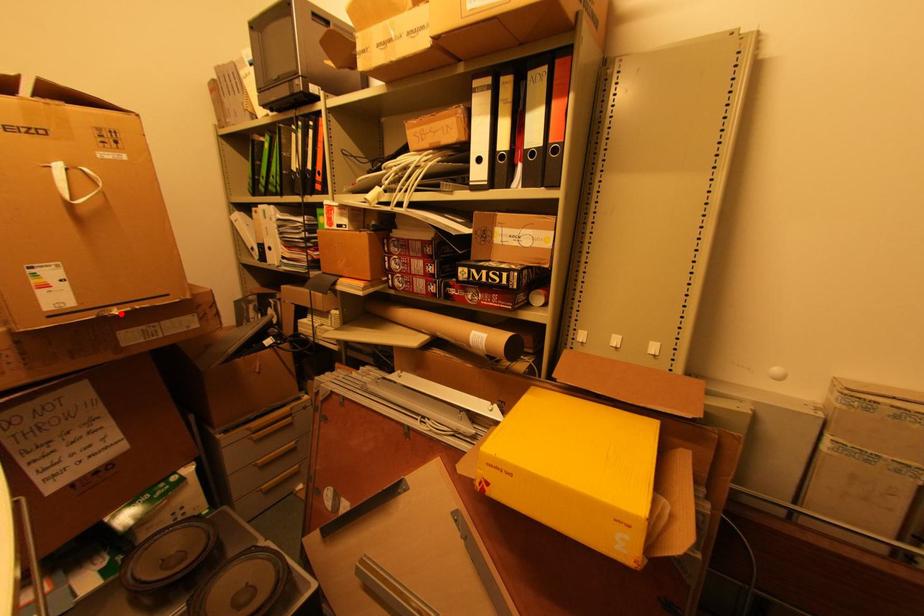
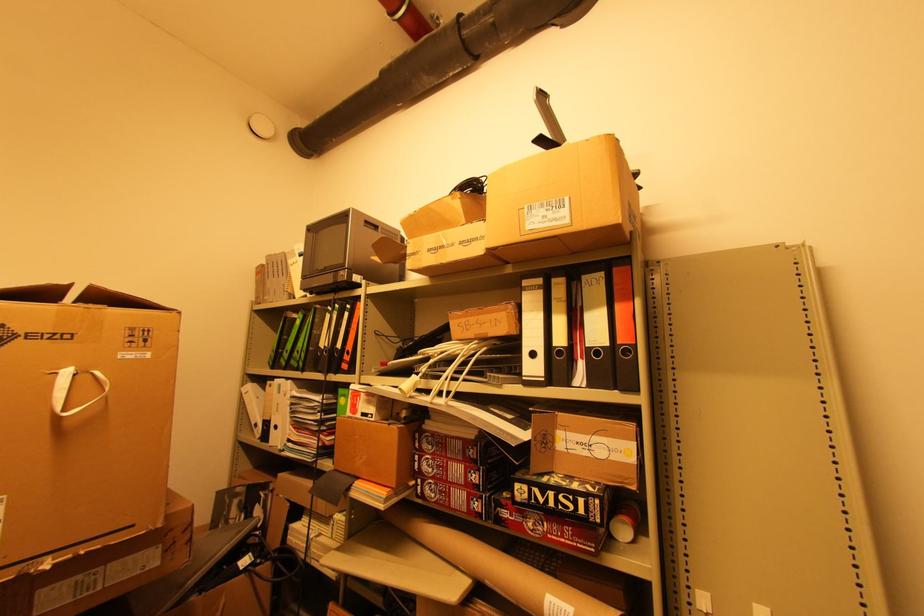
The point at the highlighted location is marked in the first image. Where is the corresponding point in the second image?

(53, 568)